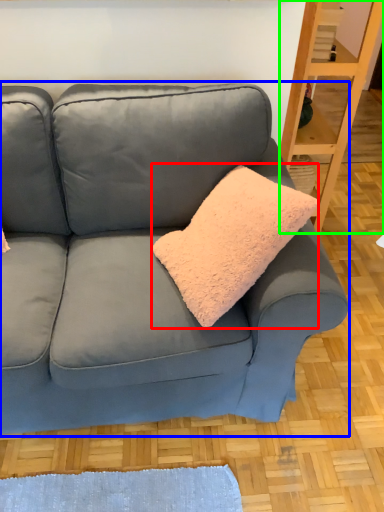
Question: Which object is positioned closest to throw pillow (highlighted by a red box)? Select from studio couch (highlighted by a blue box) and shelf (highlighted by a green box).

Choices:
 (A) studio couch
 (B) shelf

Answer: (A)